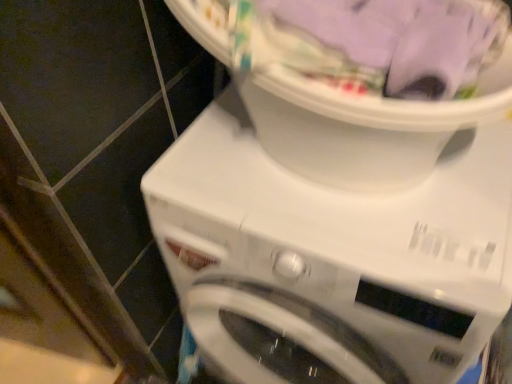
Question: In terms of width, does white plastic laundry basket at upper center look wider or thinner when compared to white plastic washing machine at center?

Choices:
 (A) thin
 (B) wide

Answer: (A)

Question: Considering the positions of point (283, 145) and point (216, 236), is point (283, 145) closer or farther from the camera than point (216, 236)?

Choices:
 (A) farther
 (B) closer

Answer: (B)

Question: Is white plastic laundry basket at upper center inside or outside of white plastic washing machine at center?

Choices:
 (A) outside
 (B) inside

Answer: (A)

Question: From the image's perspective, relative to white plastic laundry basket at upper center, is white plastic washing machine at center above or below?

Choices:
 (A) below
 (B) above

Answer: (A)

Question: In terms of height, does white plastic washing machine at center look taller or shorter compared to white plastic laundry basket at upper center?

Choices:
 (A) short
 (B) tall

Answer: (B)

Question: In the image, is white plastic washing machine at center positioned in front of or behind white plastic laundry basket at upper center?

Choices:
 (A) front
 (B) behind

Answer: (B)

Question: Does point (449, 185) appear closer or farther from the camera than point (369, 173)?

Choices:
 (A) farther
 (B) closer

Answer: (A)